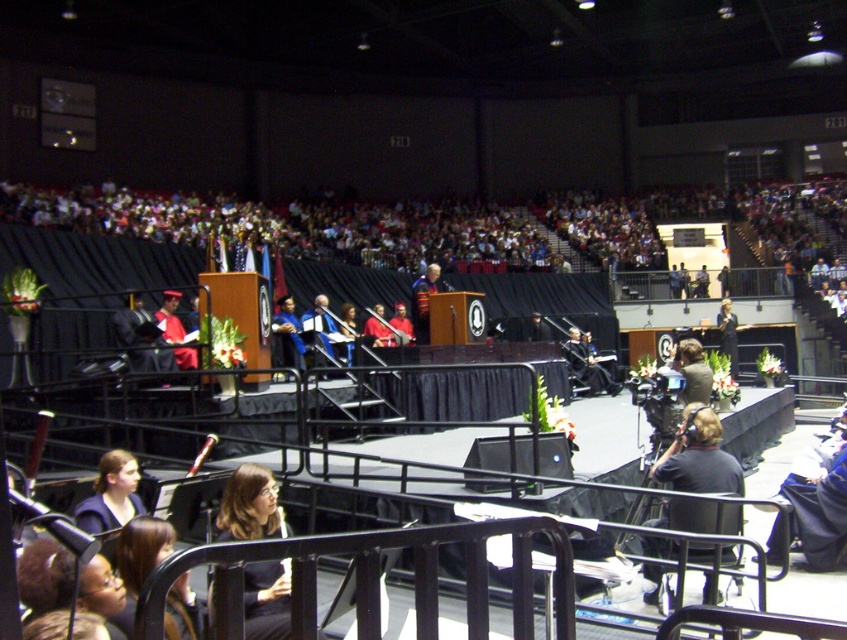
Does black fabric camera at lower right appear on the left side of dark brown hair at lower left?

Incorrect, black fabric camera at lower right is not on the left side of dark brown hair at lower left.

Measure the distance between point (702, 465) and camera.

They are 6.36 meters apart.

At what (x,y) coordinates should I click in order to perform the action: click on black fabric camera at lower right. Please return your answer as a coordinate pair (x, y). The height and width of the screenshot is (640, 847). Looking at the image, I should click on (698, 456).

Between dark brown hair at lower left and knitted sweater at center, which one has less height?

Standing shorter between the two is knitted sweater at center.

This screenshot has height=640, width=847. In order to click on dark brown hair at lower left in this screenshot , I will do `click(111, 493)`.

Consider the image. Who is more distant from viewer, (91, 508) or (435, 285)?

Positioned behind is point (435, 285).

Find the location of `dark brown hair at lower left`. dark brown hair at lower left is located at coordinates (111, 493).

Is black fabric camera at lower right above knitted sweater at center?

Actually, black fabric camera at lower right is below knitted sweater at center.

Is point (696, 470) closer to viewer compared to point (412, 296)?

Yes, point (696, 470) is in front of point (412, 296).

Is point (684, 474) positioned in front of point (429, 289)?

That is True.

What are the coordinates of `black fabric camera at lower right` in the screenshot? It's located at (698, 456).